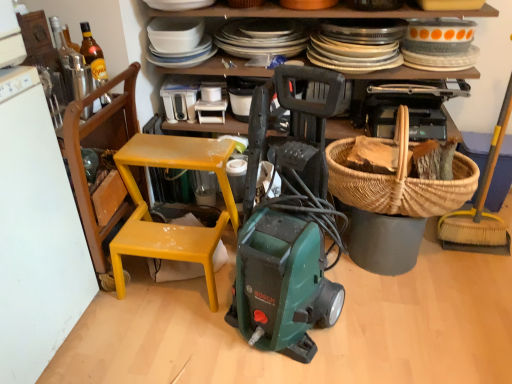
Identify the location of free location in front of yellow plastic chair at left, the 1th chair when ordered from right to left. The image size is (512, 384). (163, 345).